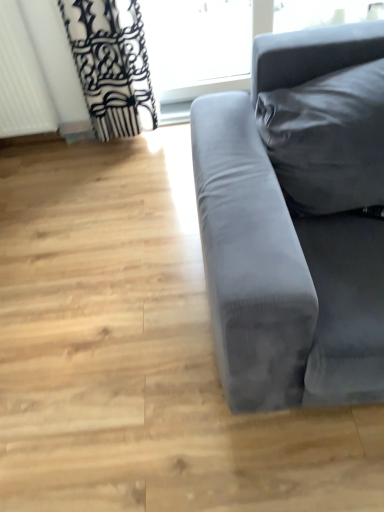
Question: Should I look upward or downward to see velvet gray couch at right?

Choices:
 (A) up
 (B) down

Answer: (A)

Question: From the image's perspective, is white textured radiator at left on velvet gray couch at right?

Choices:
 (A) yes
 (B) no

Answer: (A)

Question: Is white textured radiator at left not close to velvet gray couch at right?

Choices:
 (A) no
 (B) yes

Answer: (B)

Question: From a real-world perspective, is white textured radiator at left on velvet gray couch at right?

Choices:
 (A) no
 (B) yes

Answer: (B)

Question: Can you confirm if white textured radiator at left is bigger than velvet gray couch at right?

Choices:
 (A) yes
 (B) no

Answer: (B)

Question: Can you confirm if white textured radiator at left is smaller than velvet gray couch at right?

Choices:
 (A) yes
 (B) no

Answer: (A)

Question: Can you confirm if white textured radiator at left is wider than velvet gray couch at right?

Choices:
 (A) yes
 (B) no

Answer: (B)

Question: Can we say transparent glass window at upper center lies outside white textured radiator at left?

Choices:
 (A) yes
 (B) no

Answer: (A)

Question: Can you confirm if transparent glass window at upper center is shorter than white textured radiator at left?

Choices:
 (A) yes
 (B) no

Answer: (A)

Question: Is transparent glass window at upper center directly adjacent to white textured radiator at left?

Choices:
 (A) no
 (B) yes

Answer: (A)

Question: Can you confirm if transparent glass window at upper center is smaller than white textured radiator at left?

Choices:
 (A) yes
 (B) no

Answer: (B)

Question: Is transparent glass window at upper center oriented towards white textured radiator at left?

Choices:
 (A) yes
 (B) no

Answer: (B)

Question: Is transparent glass window at upper center oriented away from white textured radiator at left?

Choices:
 (A) no
 (B) yes

Answer: (A)

Question: From a real-world perspective, is velvet gray couch at right on top of transparent glass window at upper center?

Choices:
 (A) yes
 (B) no

Answer: (A)